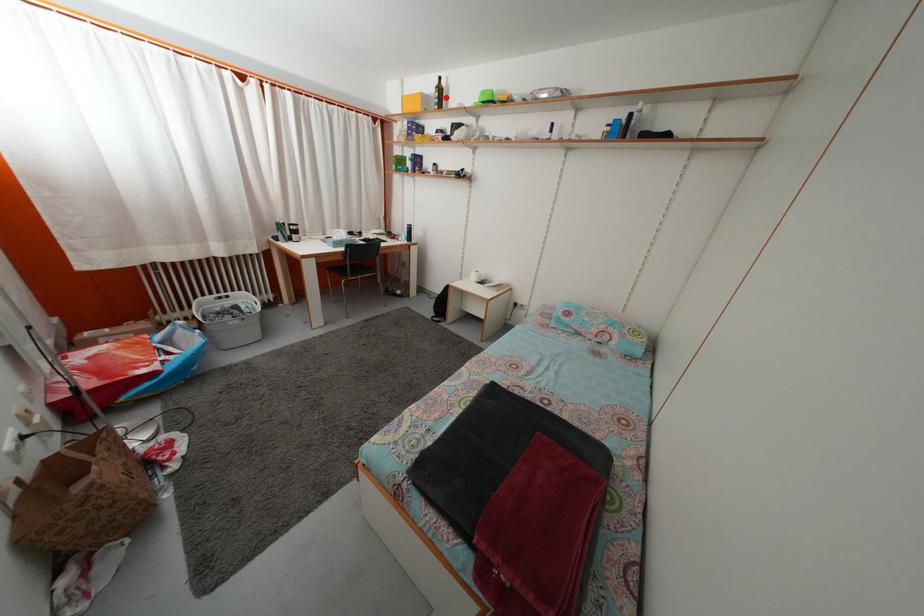
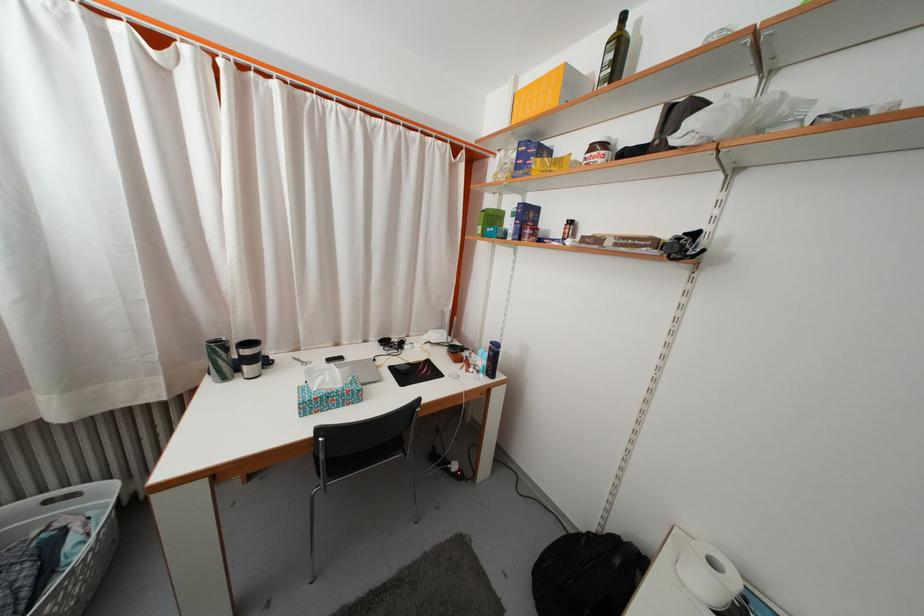
Question: I am providing you with two images of the same scene from different viewpoints. In image1, a red point is highlighted. Considering the same 3D point in image2, which of the following is correct?

Choices:
 (A) It is closer
 (B) It is farther

Answer: (B)